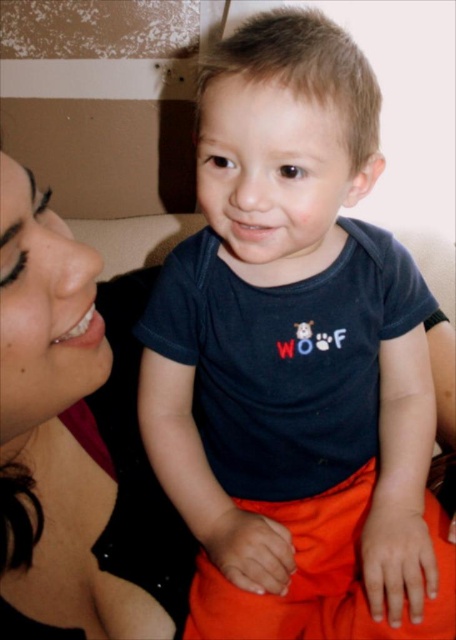
Which is more to the right, dark blue t-shirt at center or matte black hair at left?

From the viewer's perspective, dark blue t-shirt at center appears more on the right side.

Measure the distance between point (247, 616) and camera.

24.83 inches

Identify the location of dark blue t-shirt at center. (295, 358).